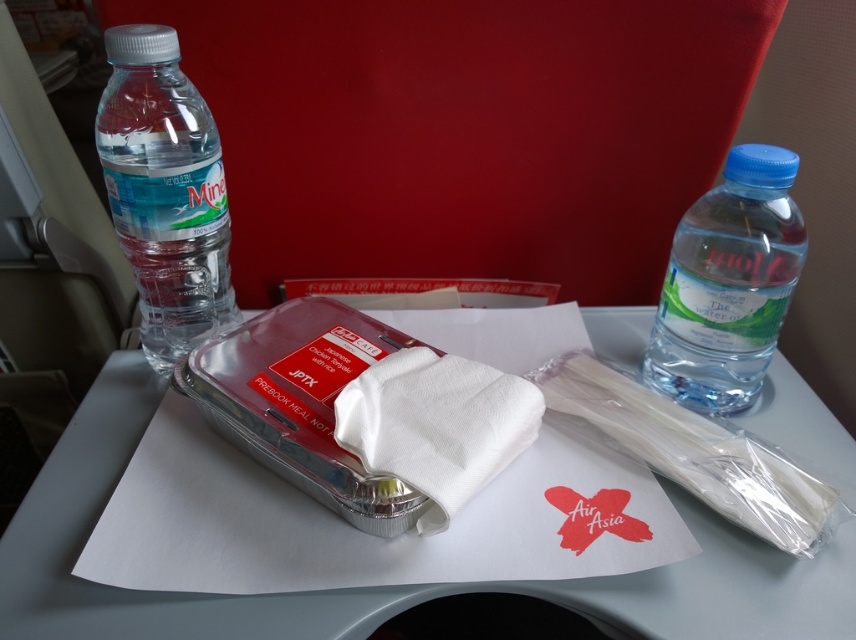
Question: Can you confirm if white paper napkin at center is positioned below clear plastic bottle at right?

Choices:
 (A) no
 (B) yes

Answer: (B)

Question: Is white paper napkin at center to the right of white paper towel at center from the viewer's perspective?

Choices:
 (A) no
 (B) yes

Answer: (B)

Question: Based on their relative distances, which object is farther from the transparent plastic bottle at left?

Choices:
 (A) white paper napkin at center
 (B) clear plastic bottle at right

Answer: (B)

Question: Is white paper napkin at center below white paper towel at center?

Choices:
 (A) yes
 (B) no

Answer: (A)

Question: Which object is positioned farthest from the white paper napkin at center?

Choices:
 (A) clear plastic bottle at right
 (B) transparent plastic bottle at left

Answer: (B)

Question: Which object appears closest to the camera in this image?

Choices:
 (A) white paper towel at center
 (B) clear plastic bottle at right

Answer: (A)